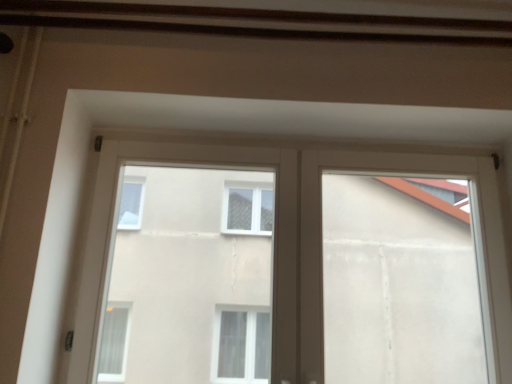
Question: Is white plastic window at upper center aimed at transparent glass window at center?

Choices:
 (A) no
 (B) yes

Answer: (B)

Question: Does white plastic window at upper center have a smaller size compared to transparent glass window at center?

Choices:
 (A) no
 (B) yes

Answer: (A)

Question: From the image's perspective, does white plastic window at upper center appear lower than transparent glass window at center?

Choices:
 (A) no
 (B) yes

Answer: (B)

Question: From the image's perspective, is white plastic window at upper center located above transparent glass window at center?

Choices:
 (A) yes
 (B) no

Answer: (B)

Question: Does white plastic window at upper center have a lesser width compared to transparent glass window at center?

Choices:
 (A) no
 (B) yes

Answer: (A)

Question: Is the position of white plastic window at upper center less distant than that of transparent glass window at center?

Choices:
 (A) yes
 (B) no

Answer: (A)

Question: Does white plastic window frame at upper center have a larger size compared to white plastic window at upper center?

Choices:
 (A) yes
 (B) no

Answer: (A)

Question: Is white plastic window frame at upper center smaller than white plastic window at upper center?

Choices:
 (A) yes
 (B) no

Answer: (B)

Question: Does white plastic window frame at upper center appear on the right side of white plastic window at upper center?

Choices:
 (A) yes
 (B) no

Answer: (A)

Question: From the image's perspective, would you say white plastic window frame at upper center is shown under white plastic window at upper center?

Choices:
 (A) no
 (B) yes

Answer: (B)

Question: Can you confirm if white plastic window frame at upper center is positioned to the left of white plastic window at upper center?

Choices:
 (A) yes
 (B) no

Answer: (B)

Question: Is the surface of white plastic window frame at upper center in direct contact with white plastic window at upper center?

Choices:
 (A) no
 (B) yes

Answer: (A)

Question: Can you confirm if transparent glass window at center is positioned to the left of white plastic window frame at upper center?

Choices:
 (A) yes
 (B) no

Answer: (A)